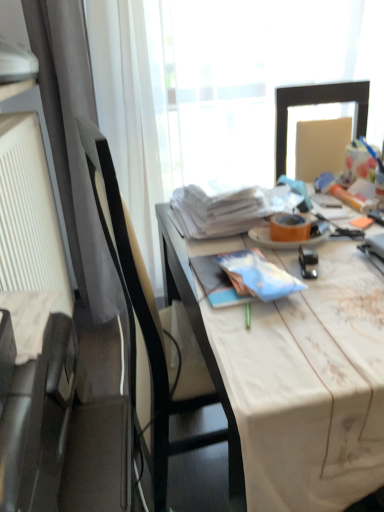
At what (x,y) coordinates should I click in order to perform the action: click on free space on the front side of orange matte plate at center. Please return your answer as a coordinate pair (x, y). This screenshot has height=512, width=384. Looking at the image, I should click on pyautogui.click(x=325, y=270).